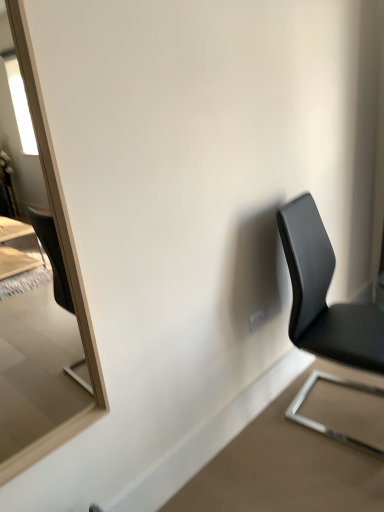
Question: Does matte wooden mirror at left appear on the right side of black leather chair at right?

Choices:
 (A) no
 (B) yes

Answer: (A)

Question: Is black leather chair at right completely or partially inside matte wooden mirror at left?

Choices:
 (A) yes
 (B) no

Answer: (B)

Question: Considering the relative sizes of matte wooden mirror at left and black leather chair at right in the image provided, is matte wooden mirror at left shorter than black leather chair at right?

Choices:
 (A) no
 (B) yes

Answer: (A)

Question: From a real-world perspective, does matte wooden mirror at left stand above black leather chair at right?

Choices:
 (A) no
 (B) yes

Answer: (B)

Question: Considering the relative sizes of matte wooden mirror at left and black leather chair at right in the image provided, is matte wooden mirror at left thinner than black leather chair at right?

Choices:
 (A) yes
 (B) no

Answer: (A)

Question: Is matte wooden mirror at left aimed at black leather chair at right?

Choices:
 (A) no
 (B) yes

Answer: (A)

Question: Is black leather chair at right at the right side of matte wooden mirror at left?

Choices:
 (A) yes
 (B) no

Answer: (A)

Question: Can you confirm if black leather chair at right is bigger than matte wooden mirror at left?

Choices:
 (A) yes
 (B) no

Answer: (A)

Question: From a real-world perspective, does black leather chair at right stand above matte wooden mirror at left?

Choices:
 (A) no
 (B) yes

Answer: (A)

Question: Is black leather chair at right further to the viewer compared to matte wooden mirror at left?

Choices:
 (A) yes
 (B) no

Answer: (A)

Question: Would you say matte wooden mirror at left is part of black leather chair at right's contents?

Choices:
 (A) no
 (B) yes

Answer: (A)

Question: From the image's perspective, does black leather chair at right appear lower than matte wooden mirror at left?

Choices:
 (A) yes
 (B) no

Answer: (A)

Question: In terms of width, does black leather chair at right look wider or thinner when compared to matte wooden mirror at left?

Choices:
 (A) wide
 (B) thin

Answer: (A)